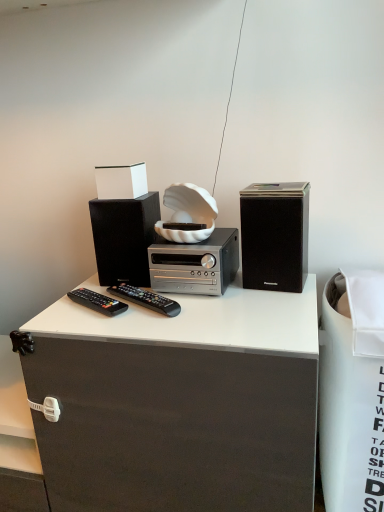
Question: In terms of size, does black matte speaker at left, which is counted as the first loudspeaker, starting from the left, appear bigger or smaller than black plastic remote at center, the 1th remote control in the right-to-left sequence?

Choices:
 (A) small
 (B) big

Answer: (B)

Question: Would you say black matte speaker at left, which is counted as the first loudspeaker, starting from the left, is to the left or to the right of black plastic remote at center, the 1th remote control in the right-to-left sequence, in the picture?

Choices:
 (A) left
 (B) right

Answer: (A)

Question: Which of these objects is positioned closest to the black plastic remote at center, the 1th remote control in the right-to-left sequence?

Choices:
 (A) silver metallic stereo at center
 (B) white matte box at upper center
 (C) black matte speaker at left, the 2th loudspeaker positioned from the right
 (D) white fabric trash bin at right
 (E) black matte speaker at right, which is the second loudspeaker in left-to-right order

Answer: (A)

Question: Which object is positioned farthest from the silver metallic stereo at center?

Choices:
 (A) black plastic remote control at lower left, placed as the first remote control when sorted from left to right
 (B) white fabric trash bin at right
 (C) black matte speaker at left, the 2th loudspeaker positioned from the right
 (D) black matte speaker at right, which is the second loudspeaker in left-to-right order
 (E) white matte box at upper center

Answer: (B)